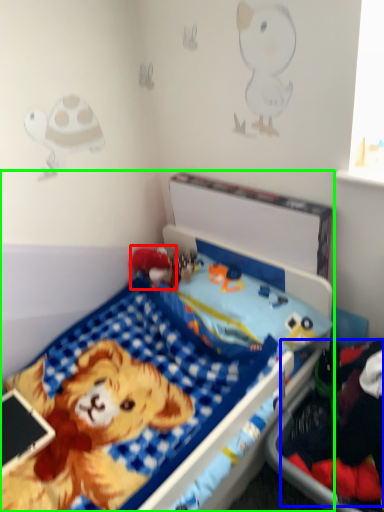
Question: Estimate the real-world distances between objects in this image. Which object is farther from toy (highlighted by a red box), clothing (highlighted by a blue box) or bed (highlighted by a green box)?

Choices:
 (A) clothing
 (B) bed

Answer: (A)